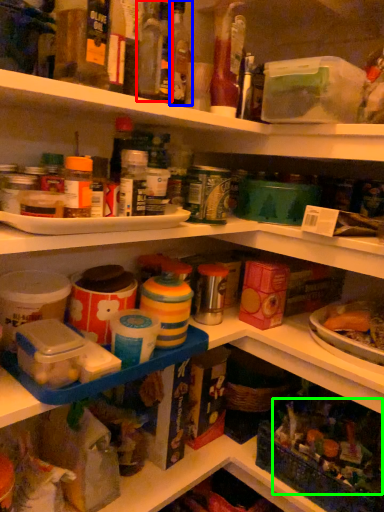
Question: Based on their relative distances, which object is nearer to bottle (highlighted by a red box)? Choose from bottle (highlighted by a blue box) and food (highlighted by a green box).

Choices:
 (A) bottle
 (B) food

Answer: (A)